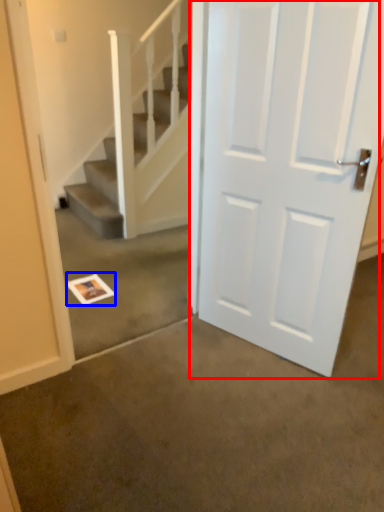
Question: Which object appears farthest to the camera in this image, door (highlighted by a red box) or postcard (highlighted by a blue box)?

Choices:
 (A) door
 (B) postcard

Answer: (B)